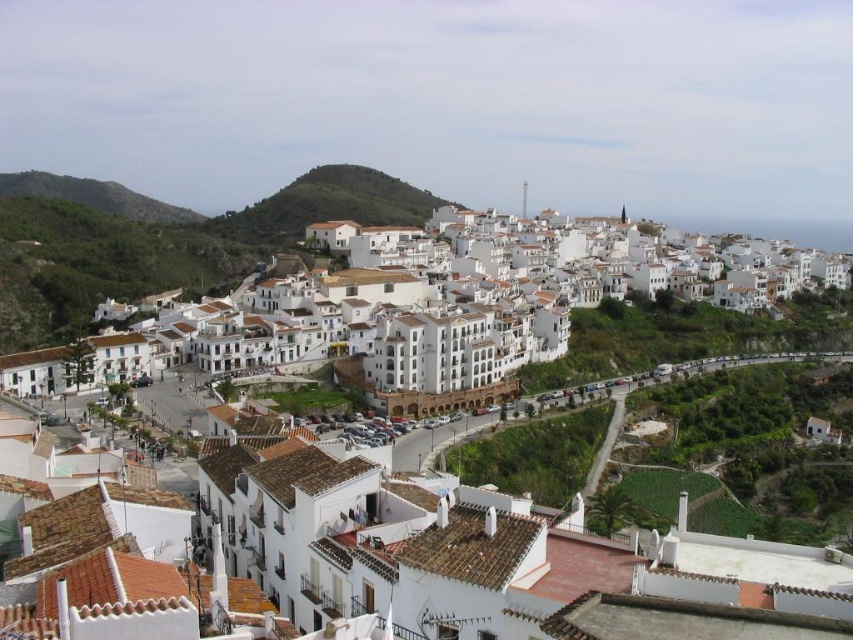
Who is shorter, white matte building at center or white stucco buildings at center?

white stucco buildings at center is shorter.

Can you confirm if white matte building at center is taller than white stucco buildings at center?

Yes, white matte building at center is taller than white stucco buildings at center.

The image size is (853, 640). Describe the element at coordinates (450, 547) in the screenshot. I see `white matte building at center` at that location.

What are the coordinates of `white matte building at center` in the screenshot? It's located at (450, 547).